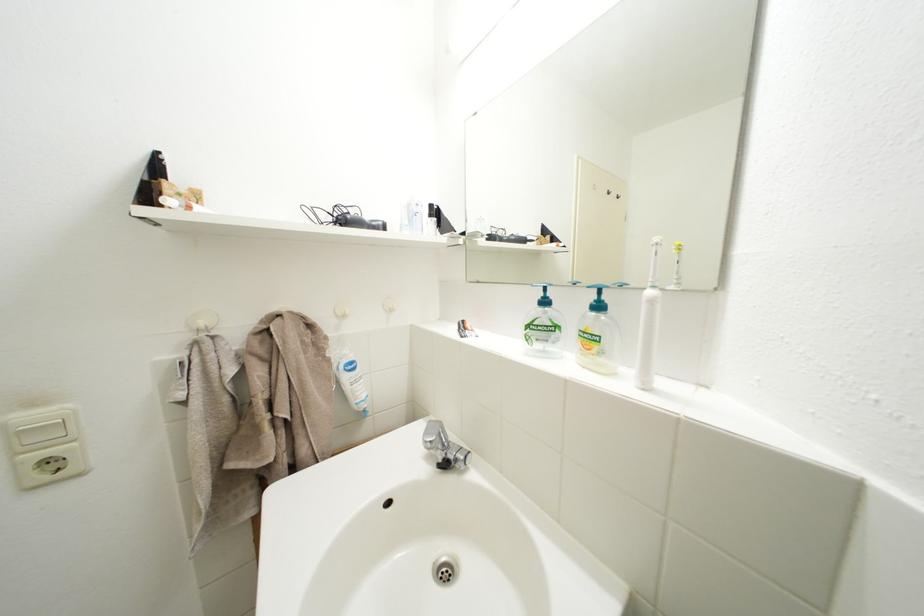
Which object does [359,222] point to?

This point indicates the black hair dryer.